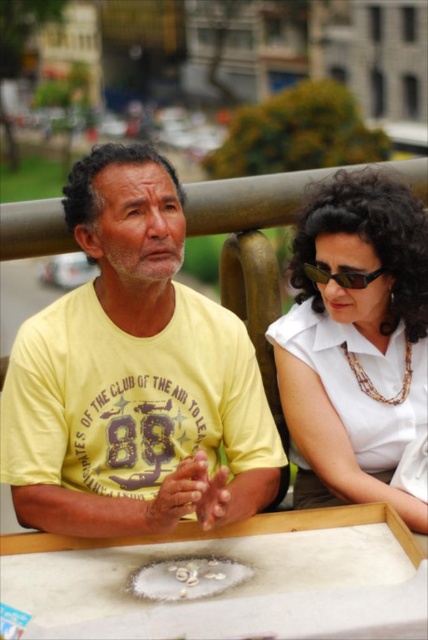
Between point (237, 470) and point (362, 371), which one is positioned behind?

Positioned behind is point (362, 371).

Does yellow cotton shirt at center have a greater height compared to white glossy shirt at upper right?

Indeed, yellow cotton shirt at center has a greater height compared to white glossy shirt at upper right.

Between point (27, 333) and point (392, 452), which one is positioned in front?

Point (27, 333) is in front.

The width and height of the screenshot is (428, 640). Find the location of `yellow cotton shirt at center`. yellow cotton shirt at center is located at coordinates (133, 376).

Between white glossy shirt at upper right and white matte table at center, which one is positioned lower?

white matte table at center

Does white glossy shirt at upper right have a larger size compared to white matte table at center?

Yes.

Locate an element on the screen. The height and width of the screenshot is (640, 428). white glossy shirt at upper right is located at coordinates (356, 342).

Can you confirm if white matte table at center is shorter than black reflective sunglasses at upper right?

Incorrect, white matte table at center's height does not fall short of black reflective sunglasses at upper right's.

Which is in front, point (380, 593) or point (318, 268)?

Positioned in front is point (380, 593).

Locate an element on the screen. white matte table at center is located at coordinates (231, 588).